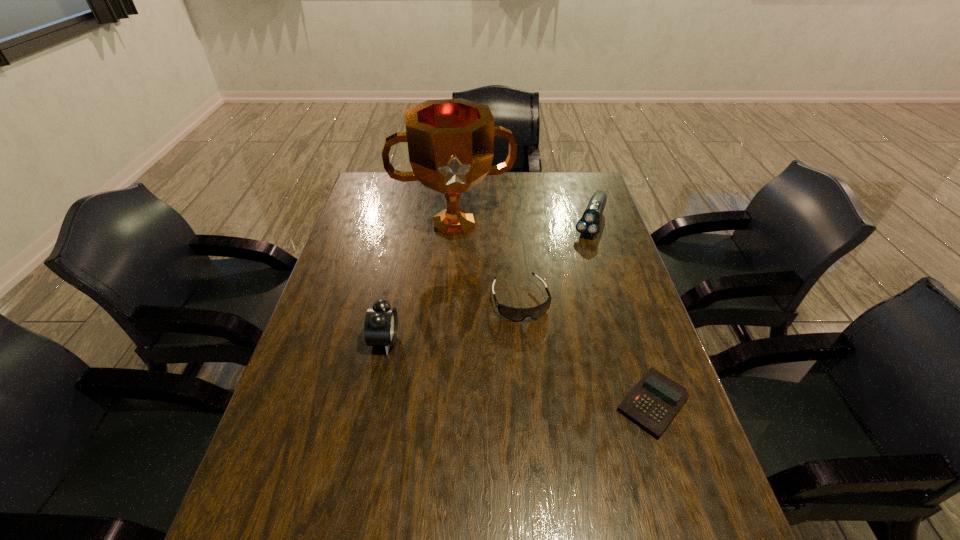
Locate an element on the screen. The height and width of the screenshot is (540, 960). free region located 0.290m on the head of the third tallest object is located at coordinates (565, 296).

Find the location of a particular element. free space located 0.090m on the head of the third tallest object is located at coordinates (582, 256).

This screenshot has width=960, height=540. What are the coordinates of `vacant area situated 0.390m on the head of the third tallest object` in the screenshot? It's located at (556, 320).

What are the coordinates of `free point located 0.150m on the side of the tallest object with the star emblem` in the screenshot? It's located at (467, 278).

The width and height of the screenshot is (960, 540). I want to click on free region located on the side of the tallest object with the star emblem, so click(x=479, y=342).

The width and height of the screenshot is (960, 540). What are the coordinates of `blank space located on the side of the tallest object with the star emblem` in the screenshot? It's located at click(x=464, y=259).

You are a GUI agent. You are given a task and a screenshot of the screen. Output one action in this format:
    pyautogui.click(x=<x>, y=<y>)
    Task: Click on the vacant point located on the front and sides of the goggles
    
    Given the screenshot: What is the action you would take?
    pyautogui.click(x=546, y=375)

Image resolution: width=960 pixels, height=540 pixels. What are the coordinates of `free location located 0.260m on the front and sides of the goggles` in the screenshot? It's located at (558, 408).

Locate an element on the screen. free space located 0.330m on the front and sides of the goggles is located at coordinates (567, 436).

I want to click on electric shaver that is positioned at the far edge, so click(x=588, y=225).